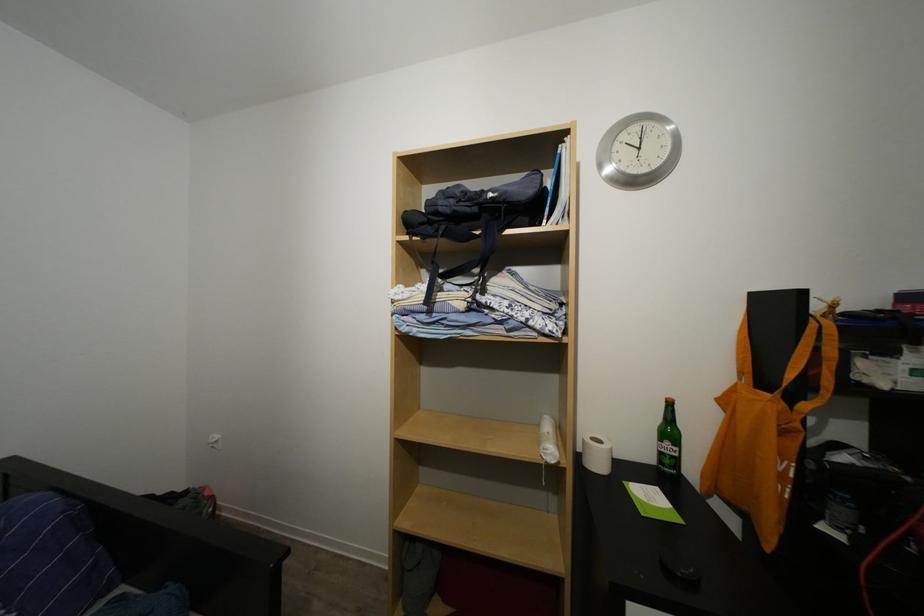
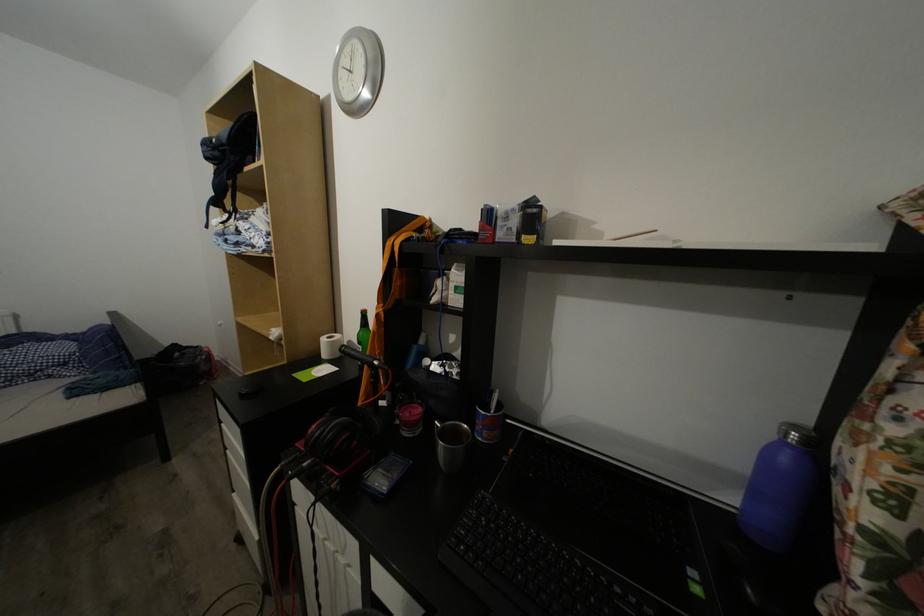
Question: What movement of the cameraman would produce the second image?

Choices:
 (A) Left
 (B) Right
 (C) Forward
 (D) Backward

Answer: (B)